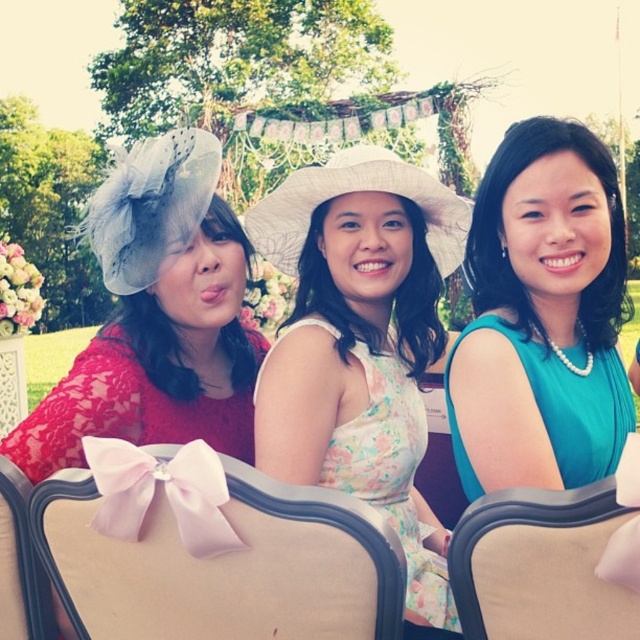
You are a photographer trying to capture a closeup of the lace fabric hat at left and the beige fabric chair at lower left. Since you want both objects to appear equally sized in the photo, which object should you move closer to the camera?

Since the lace fabric hat at left is wider than the beige fabric chair at lower left, you should move the beige fabric chair at lower left closer to the camera to make them appear the same size in the photo.

You are a photographer trying to capture a clear shot of the lace fabric hat at left and the beige fabric chair at lower left. Which object is taller and would require adjusting the camera angle upwards to focus properly?

The lace fabric hat at left is taller than the beige fabric chair at lower left, so you would need to adjust the camera angle upwards to focus on the lace fabric hat at left.

You are a photographer trying to capture a group photo of the three women. Since the floral dress at center and the pink fabric chair at center are in the scene, which one is shorter?

The floral dress at center is shorter than the pink fabric chair at center.